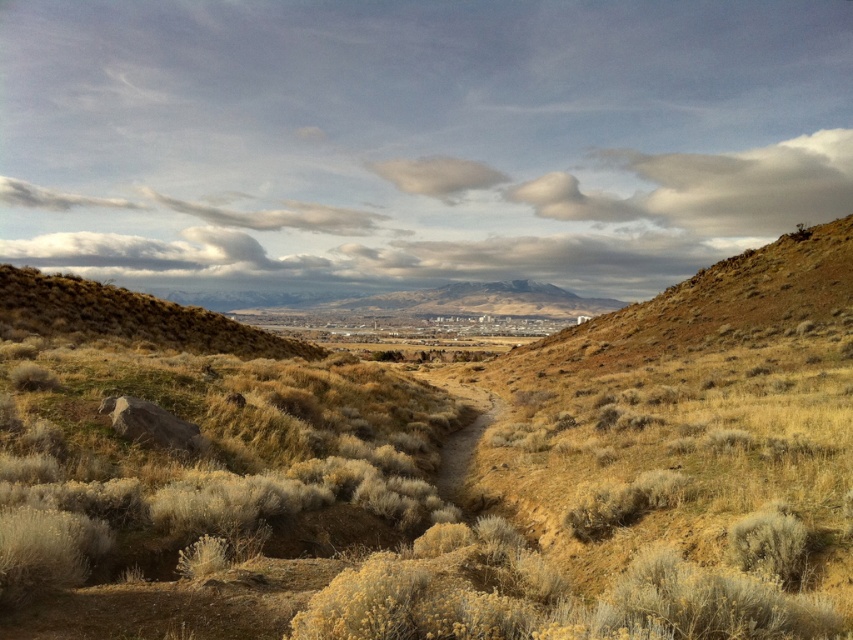
Question: Which of the following is the farthest from the observer?

Choices:
 (A) white fluffy cloud at upper center
 (B) brown dirt path at center

Answer: (A)

Question: Which object appears closest to the camera in this image?

Choices:
 (A) white fluffy cloud at upper center
 (B) brown dirt path at center

Answer: (B)

Question: Where is white fluffy cloud at upper center located in relation to brown dirt path at center in the image?

Choices:
 (A) right
 (B) left

Answer: (B)

Question: Is white fluffy cloud at upper center positioned in front of brown dirt path at center?

Choices:
 (A) yes
 (B) no

Answer: (B)

Question: Which point appears farthest from the camera in this image?

Choices:
 (A) (444, 451)
 (B) (457, 161)

Answer: (B)

Question: Does white fluffy cloud at upper center have a larger size compared to brown dirt path at center?

Choices:
 (A) no
 (B) yes

Answer: (B)